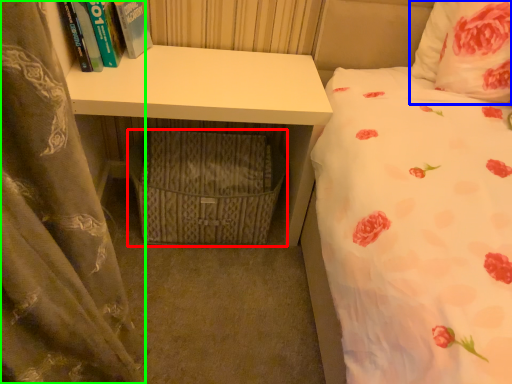
Question: Based on their relative distances, which object is farther from crate (highlighted by a red box)? Choose from pillow (highlighted by a blue box) and curtain (highlighted by a green box).

Choices:
 (A) pillow
 (B) curtain

Answer: (A)